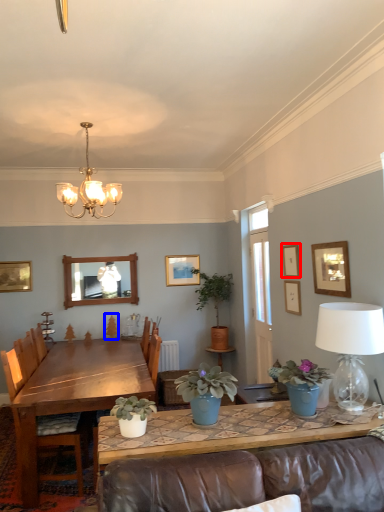
Question: Which of the following is the closest to the observer, picture frame (highlighted by a red box) or plant (highlighted by a blue box)?

Choices:
 (A) picture frame
 (B) plant

Answer: (A)